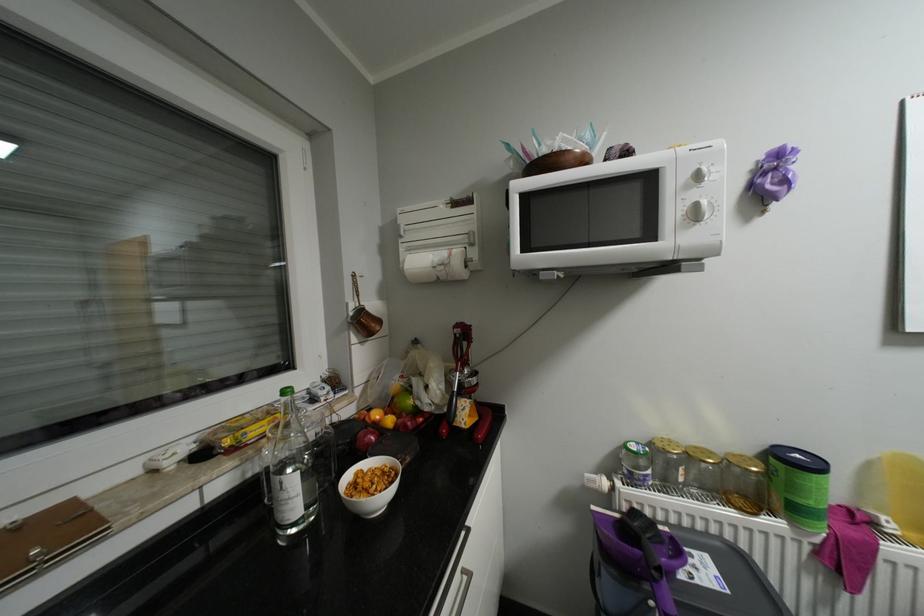
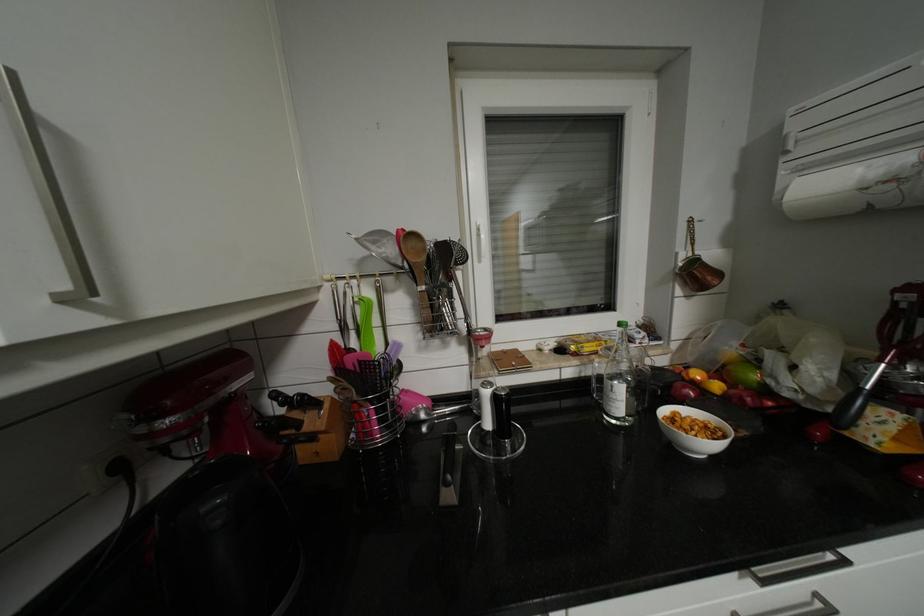
Find the pixel in the second image that matches point 294,484 in the first image.

(623, 387)